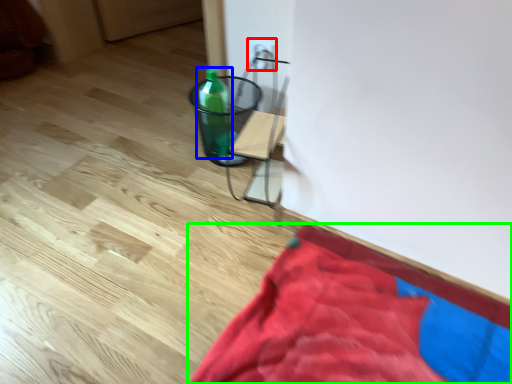
Question: Which object is positioned farthest from electric outlet (highlighted by a red box)? Select from bottle (highlighted by a blue box) and blanket (highlighted by a green box).

Choices:
 (A) bottle
 (B) blanket

Answer: (B)